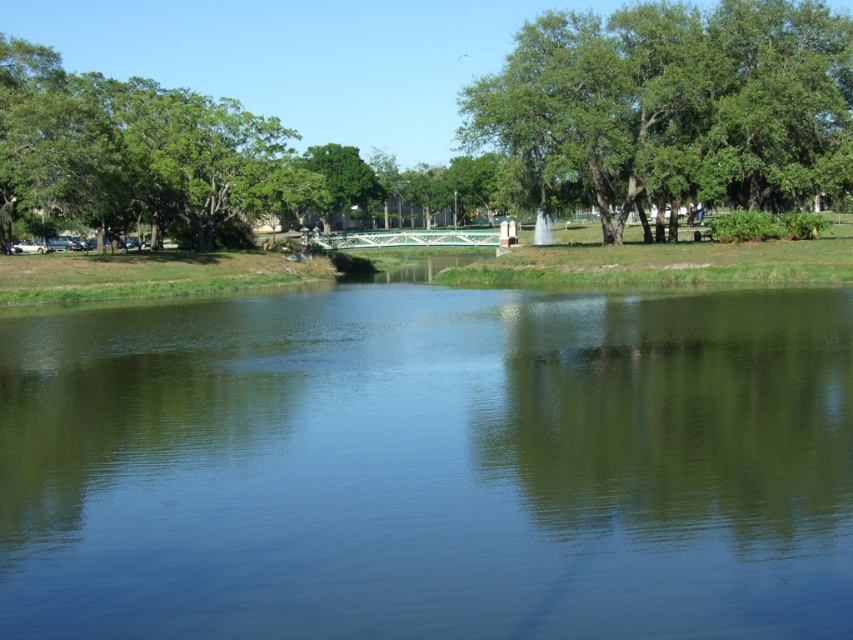
Question: Does green reflective water at center have a larger size compared to green leafy tree at upper right?

Choices:
 (A) yes
 (B) no

Answer: (B)

Question: Which object appears farthest from the camera in this image?

Choices:
 (A) green leafy tree at upper left
 (B) green reflective water at center

Answer: (A)

Question: Which of the following is the farthest from the observer?

Choices:
 (A) green leafy tree at upper right
 (B) green leafy tree at upper left

Answer: (B)

Question: Is green reflective water at center to the left of green leafy tree at upper left from the viewer's perspective?

Choices:
 (A) yes
 (B) no

Answer: (B)

Question: Considering the real-world distances, which object is closest to the green reflective water at center?

Choices:
 (A) green leafy tree at upper right
 (B) green leafy tree at upper left

Answer: (A)

Question: Is green leafy tree at upper right to the right of green leafy tree at upper left from the viewer's perspective?

Choices:
 (A) yes
 (B) no

Answer: (A)